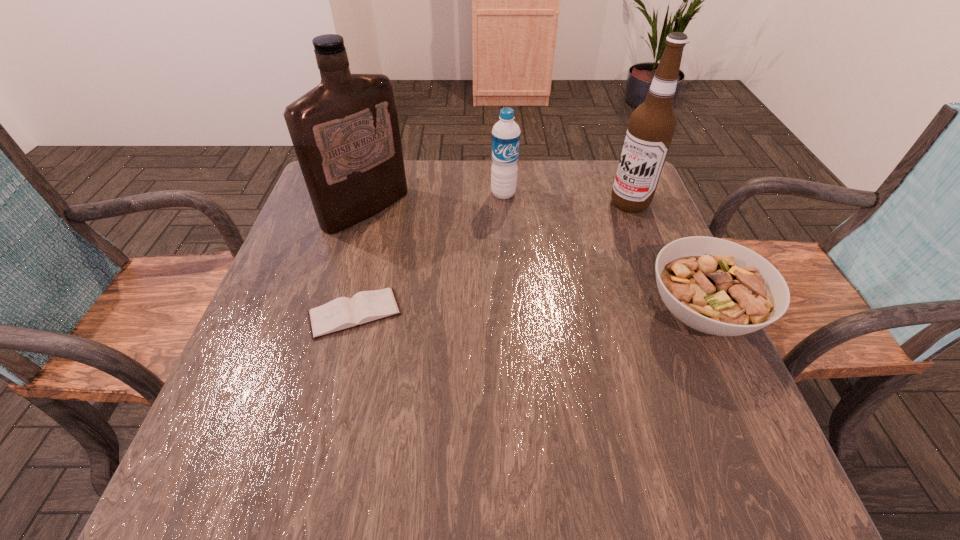
This screenshot has width=960, height=540. Find the location of `diary present at the left edge`. diary present at the left edge is located at coordinates (342, 313).

The image size is (960, 540). Identify the location of liquor positioned at the left edge. (345, 131).

Locate an element on the screen. The width and height of the screenshot is (960, 540). stew positioned at the right edge is located at coordinates coord(715,286).

What are the coordinates of `alcohol that is positioned at the right edge` in the screenshot? It's located at (652, 125).

This screenshot has width=960, height=540. I want to click on object that is positioned at the far left corner, so click(x=345, y=131).

The image size is (960, 540). I want to click on object that is at the far right corner, so click(x=652, y=125).

The width and height of the screenshot is (960, 540). Identify the location of blank area at the far edge. (458, 188).

Identify the location of vacant region at the near edge of the desktop. (386, 429).

Identify the location of vacant space at the left edge. (323, 235).

Image resolution: width=960 pixels, height=540 pixels. I want to click on free space at the right edge, so click(616, 280).